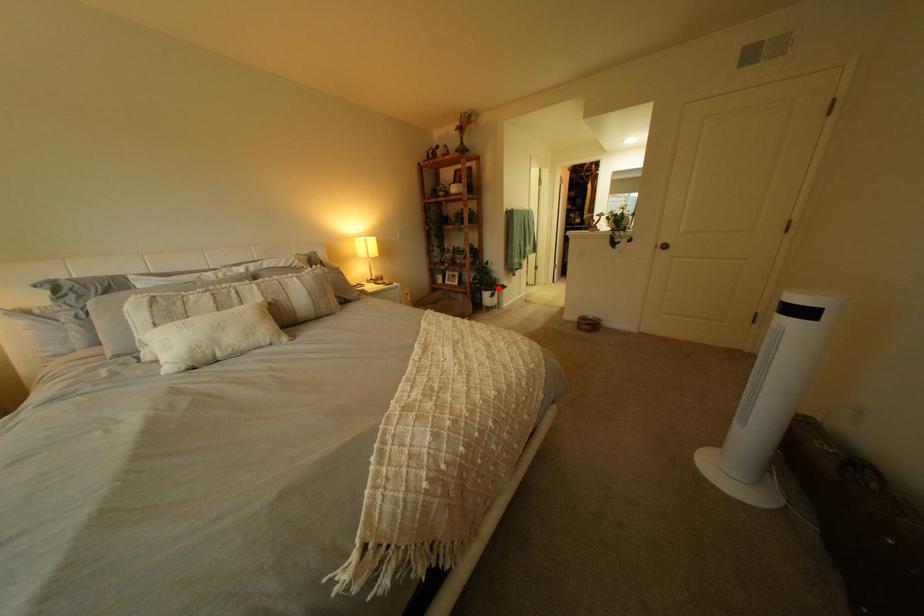
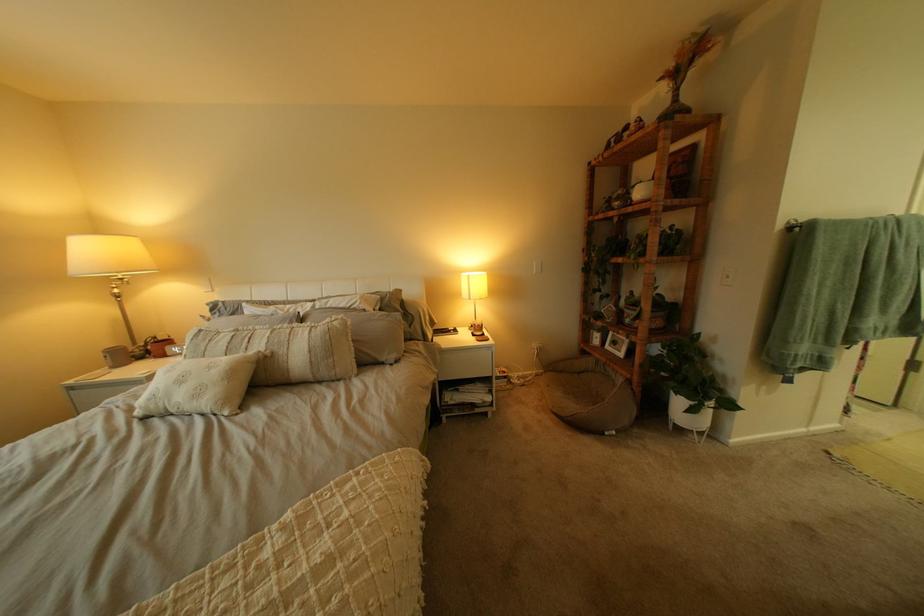
Question: A red point is marked in image1. In image2, is the corresponding 3D point closer to the camera or farther? Reply with the corresponding letter.

Choices:
 (A) The corresponding 3D point is closer.
 (B) The corresponding 3D point is farther.

Answer: (B)